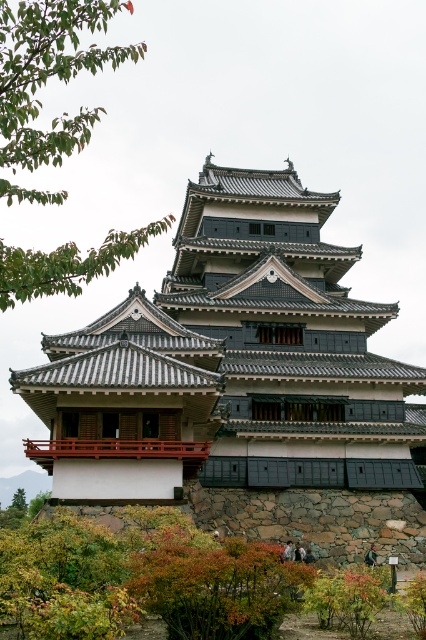
You are an architect analyzing the layout of a traditional Japanese castle. You notice the stone gray temple at center and the green leafy branch at upper left. Which object takes up more area in the image?

The green leafy branch at upper left takes up more area in the image than the stone gray temple at center because the stone gray temple at center occupies less space than green leafy branch at upper left.

Based on the photo, you are standing in front of the traditional Japanese castle. You notice the stone gray temple at center and the green leafy tree at lower left. Which object is taller?

The stone gray temple at center is taller than the green leafy tree at lower left according to the description.

You are planning to take a photo of the stone gray temple at center and the green leafy tree at lower left. Since you want both to be in focus, which object should you focus on first to ensure the other is also sharp in the photo?

The stone gray temple at center has a larger size compared to green leafy tree at lower left, so you should focus on the stone gray temple at center first to ensure both are in focus.